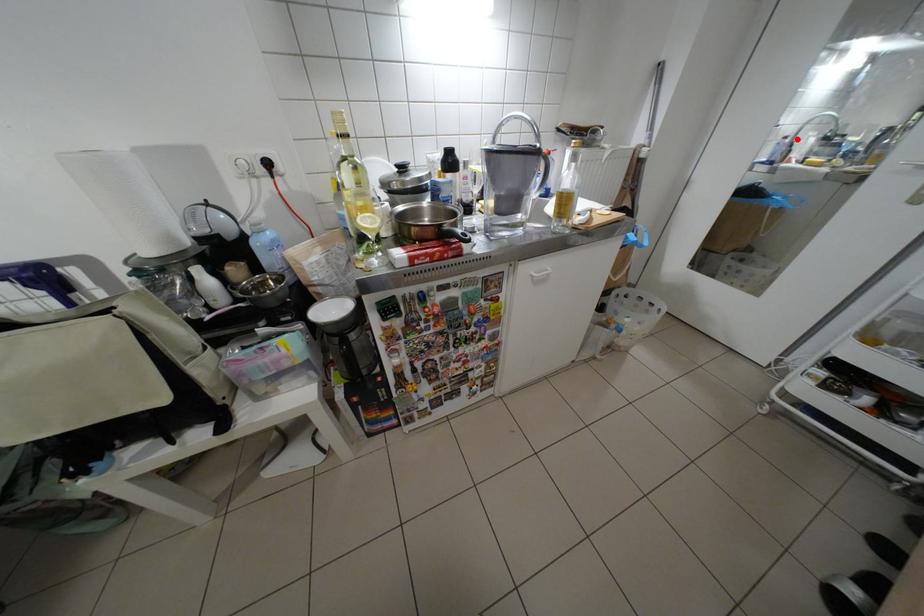
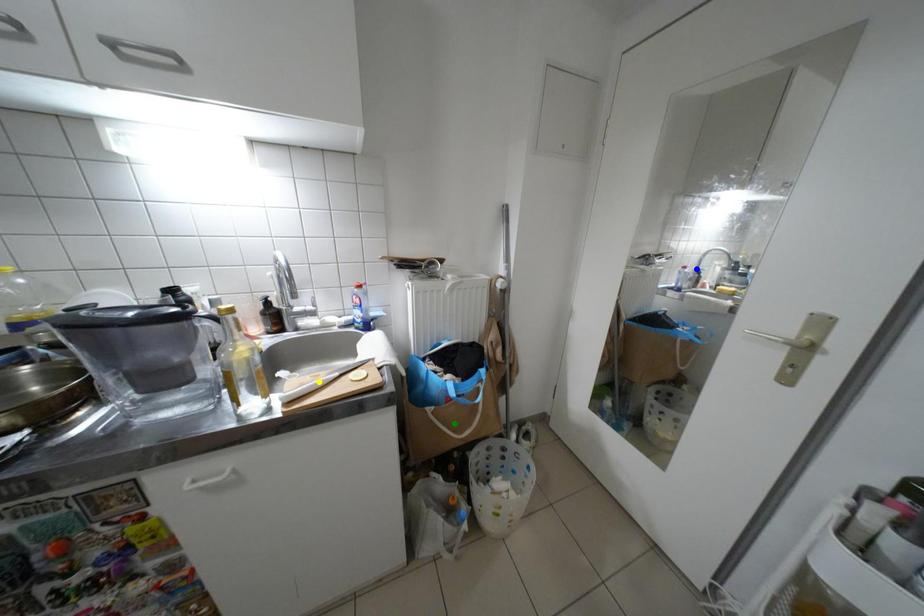
Question: I am providing you with two images of the same scene from different viewpoints. A red point is marked on the first image. You are given multiple points on the second image. Which spot in image 2 lines up with the point in image 1?

Choices:
 (A) yellow point
 (B) blue point
 (C) green point

Answer: (B)